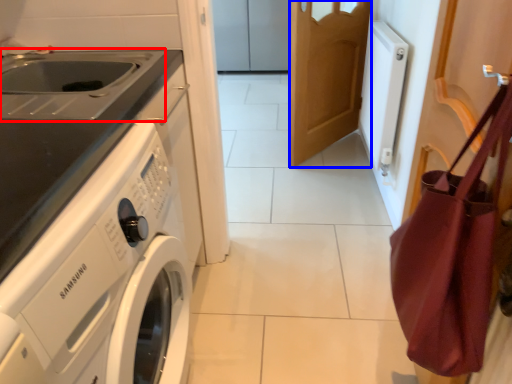
Question: Which of the following is the closest to the observer, sink (highlighted by a red box) or door (highlighted by a blue box)?

Choices:
 (A) sink
 (B) door

Answer: (A)